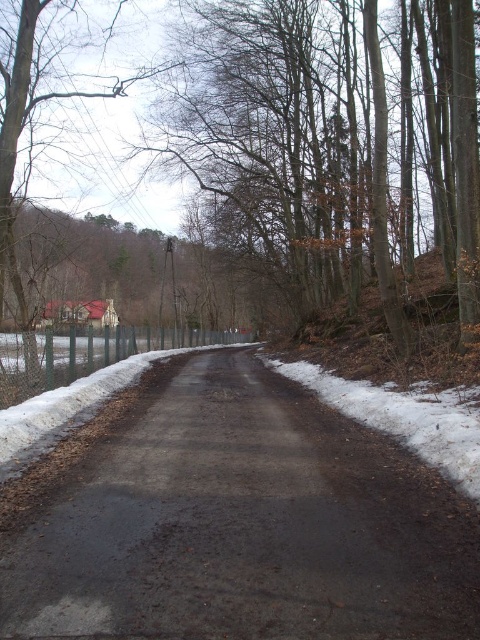
Question: Does brown/dry wood at center have a smaller size compared to white powdery snow at right?

Choices:
 (A) yes
 (B) no

Answer: (B)

Question: Which point is closer to the camera?

Choices:
 (A) 79,339
 (B) 298,305
 (C) 204,396

Answer: (C)

Question: Can you confirm if dark asphalt road at center is positioned to the left of white powdery snow at right?

Choices:
 (A) yes
 (B) no

Answer: (A)

Question: Is brown/dry wood at center to the right of white powdery snow at right from the viewer's perspective?

Choices:
 (A) no
 (B) yes

Answer: (B)

Question: Which of the following is the closest to the observer?

Choices:
 (A) (97, 518)
 (B) (34, 342)
 (C) (211, 192)

Answer: (A)

Question: Which object is the farthest from the green metallic fence at left?

Choices:
 (A) brown/dry wood at center
 (B) dark asphalt road at center

Answer: (A)